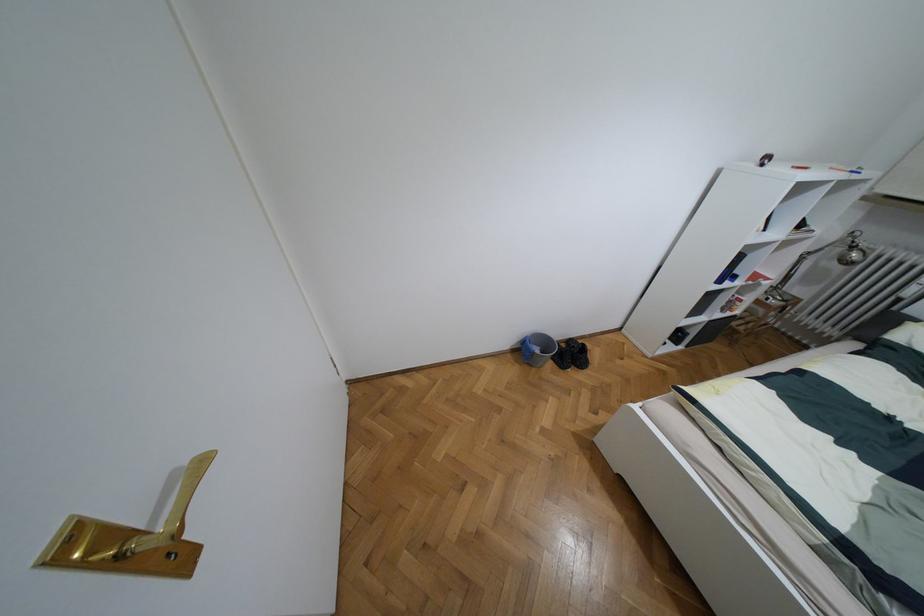
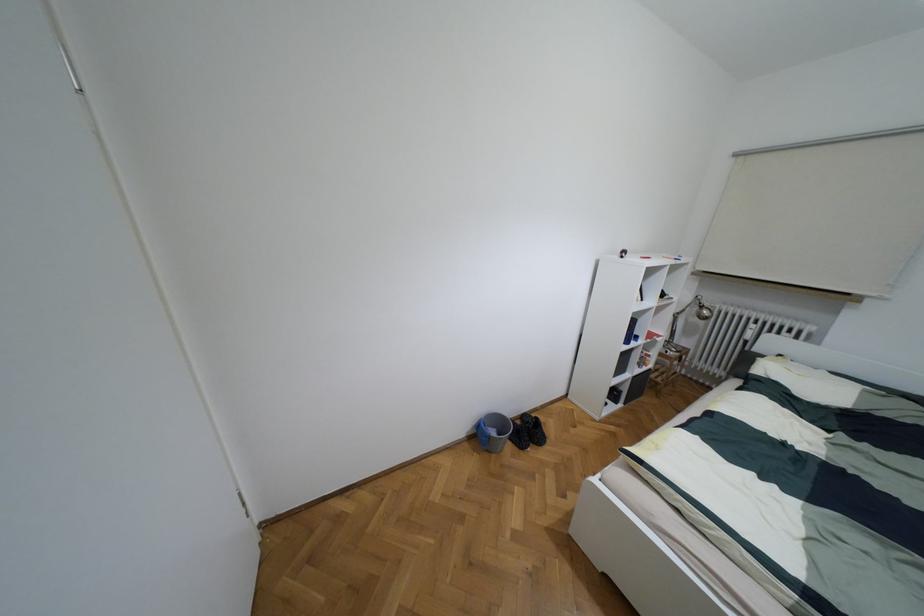
Question: The images are taken continuously from a first-person perspective. In which direction is your viewpoint rotating?

Choices:
 (A) Left
 (B) Right
 (C) Up
 (D) Down

Answer: (C)